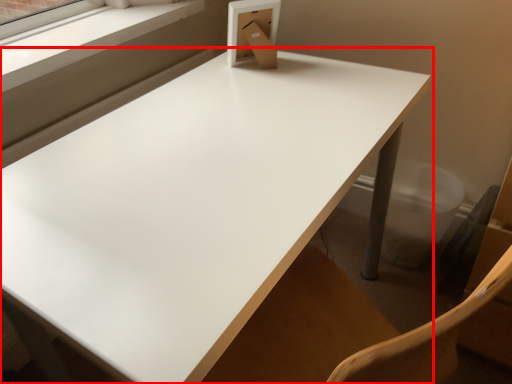
Question: In this image, where is table (annotated by the red box) located relative to window frame?

Choices:
 (A) right
 (B) left

Answer: (A)